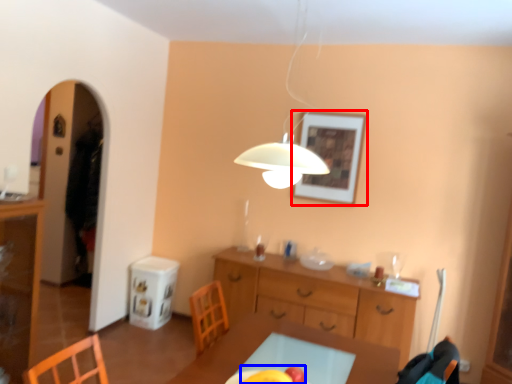
Question: Which object is closer to the camera taking this photo, picture frame (highlighted by a red box) or fruit (highlighted by a blue box)?

Choices:
 (A) picture frame
 (B) fruit

Answer: (B)